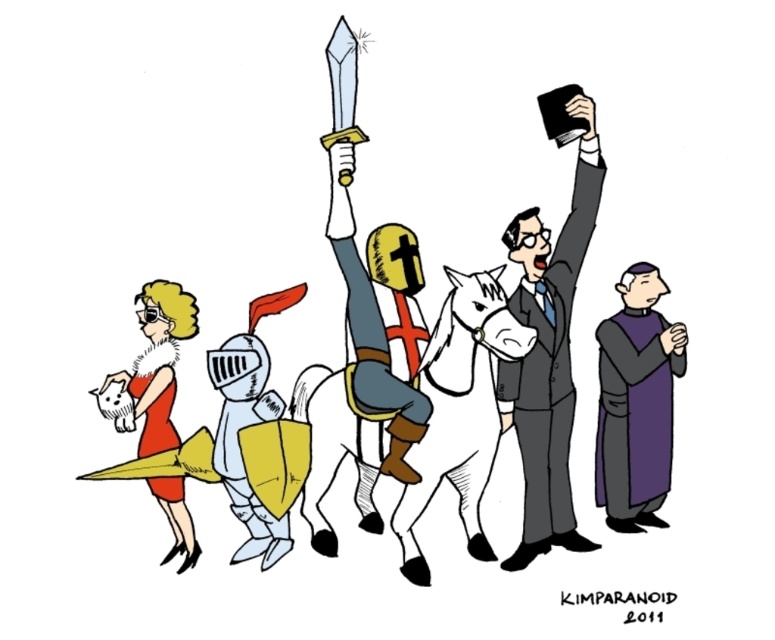
Which is more to the right, purple velvet robe at right or matte red dress at left?

purple velvet robe at right is more to the right.

Can you confirm if purple velvet robe at right is taller than matte red dress at left?

Yes.

Which is in front, point (608, 497) or point (174, 301)?

Positioned in front is point (174, 301).

Identify the location of purple velvet robe at right. (636, 403).

Based on the photo, does gray suit at right have a greater width compared to matte red dress at left?

Indeed, gray suit at right has a greater width compared to matte red dress at left.

Is gray suit at right closer to the viewer compared to matte red dress at left?

Yes, it is in front of matte red dress at left.

Is point (525, 212) positioned in front of point (167, 356)?

No, it is not.

The image size is (775, 640). Find the location of `gray suit at right`. gray suit at right is located at coordinates (549, 337).

Can you confirm if gray suit at right is positioned below purple velvet robe at right?

Incorrect, gray suit at right is not positioned below purple velvet robe at right.

Locate an element on the screen. gray suit at right is located at coordinates (549, 337).

What do you see at coordinates (549, 337) in the screenshot? The width and height of the screenshot is (775, 640). I see `gray suit at right` at bounding box center [549, 337].

I want to click on gray suit at right, so click(549, 337).